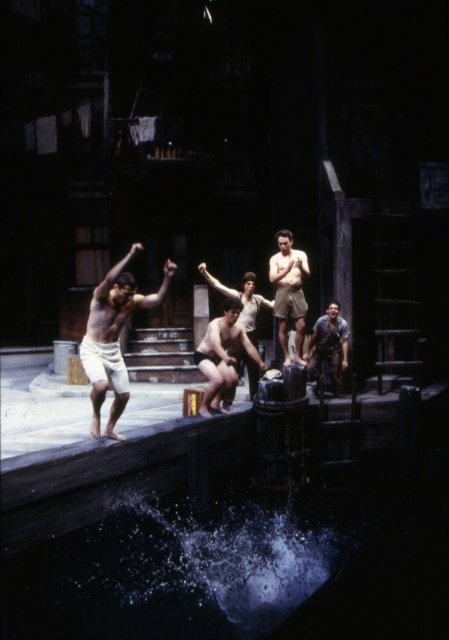
This screenshot has height=640, width=449. Identify the location of smooth white shorts at center. (114, 337).

This screenshot has width=449, height=640. In order to click on smooth white shorts at center in this screenshot , I will do `click(114, 337)`.

Is point (228, 506) less distant than point (223, 307)?

No, it is not.

Is clear liquid water at lower center to the left of smooth skin man at center from the viewer's perspective?

Correct, you'll find clear liquid water at lower center to the left of smooth skin man at center.

Does point (75, 620) come farther from viewer compared to point (229, 381)?

No, (75, 620) is in front of (229, 381).

Locate an element on the screen. The width and height of the screenshot is (449, 640). clear liquid water at lower center is located at coordinates (174, 572).

Who is lower down, smooth white shorts at center or rusty metal man at center?

rusty metal man at center is lower down.

Can you confirm if smooth white shorts at center is taller than rusty metal man at center?

Yes, smooth white shorts at center is taller than rusty metal man at center.

Where is `smooth white shorts at center`? Image resolution: width=449 pixels, height=640 pixels. smooth white shorts at center is located at coordinates (114, 337).

I want to click on smooth white shorts at center, so click(114, 337).